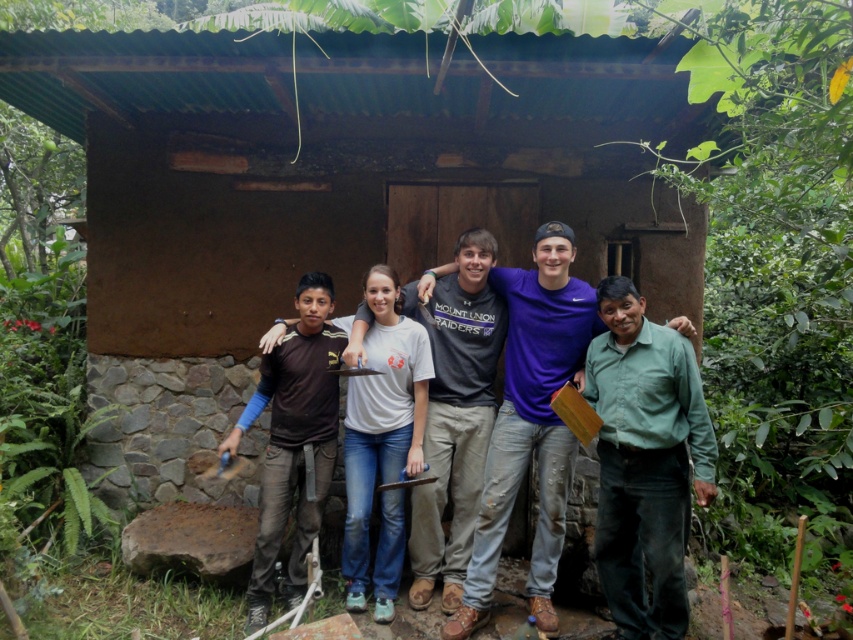
Where is `green cotton shirt at right`? This screenshot has width=853, height=640. green cotton shirt at right is located at coordinates (643, 460).

Who is lower down, green cotton shirt at right or matte gray shirt at center?

green cotton shirt at right is lower down.

Image resolution: width=853 pixels, height=640 pixels. Describe the element at coordinates (643, 460) in the screenshot. I see `green cotton shirt at right` at that location.

Identify the location of green cotton shirt at right. Image resolution: width=853 pixels, height=640 pixels. (643, 460).